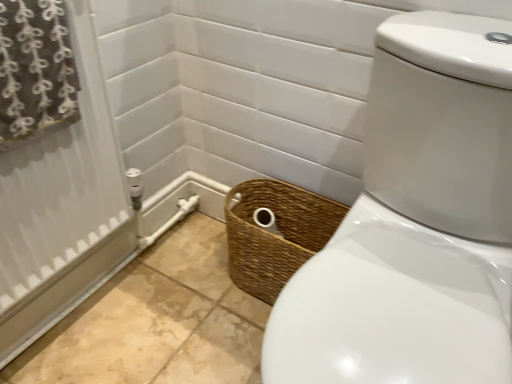
Question: Should I look upward or downward to see brown textured fabric at upper left?

Choices:
 (A) up
 (B) down

Answer: (A)

Question: Considering the relative positions of woven brown basket at lower center and brown textured fabric at upper left in the image provided, is woven brown basket at lower center to the right of brown textured fabric at upper left from the viewer's perspective?

Choices:
 (A) no
 (B) yes

Answer: (B)

Question: From the image's perspective, is woven brown basket at lower center on brown textured fabric at upper left?

Choices:
 (A) no
 (B) yes

Answer: (A)

Question: Is woven brown basket at lower center bigger than brown textured fabric at upper left?

Choices:
 (A) no
 (B) yes

Answer: (B)

Question: Considering the relative positions of woven brown basket at lower center and brown textured fabric at upper left in the image provided, is woven brown basket at lower center behind brown textured fabric at upper left?

Choices:
 (A) yes
 (B) no

Answer: (A)

Question: Considering the relative sizes of woven brown basket at lower center and brown textured fabric at upper left in the image provided, is woven brown basket at lower center wider than brown textured fabric at upper left?

Choices:
 (A) no
 (B) yes

Answer: (B)

Question: Does woven brown basket at lower center have a greater height compared to brown textured fabric at upper left?

Choices:
 (A) no
 (B) yes

Answer: (B)

Question: Does brown textured fabric at upper left turn towards woven brown basket at lower center?

Choices:
 (A) yes
 (B) no

Answer: (B)

Question: Is brown textured fabric at upper left shorter than woven brown basket at lower center?

Choices:
 (A) yes
 (B) no

Answer: (A)

Question: Can you confirm if brown textured fabric at upper left is bigger than woven brown basket at lower center?

Choices:
 (A) yes
 (B) no

Answer: (B)

Question: Does brown textured fabric at upper left come behind woven brown basket at lower center?

Choices:
 (A) no
 (B) yes

Answer: (A)

Question: From a real-world perspective, is brown textured fabric at upper left located higher than woven brown basket at lower center?

Choices:
 (A) no
 (B) yes

Answer: (B)

Question: From the image's perspective, would you say brown textured fabric at upper left is positioned over woven brown basket at lower center?

Choices:
 (A) no
 (B) yes

Answer: (B)

Question: In terms of height, does woven brown basket at lower center look taller or shorter compared to brown textured fabric at upper left?

Choices:
 (A) tall
 (B) short

Answer: (A)